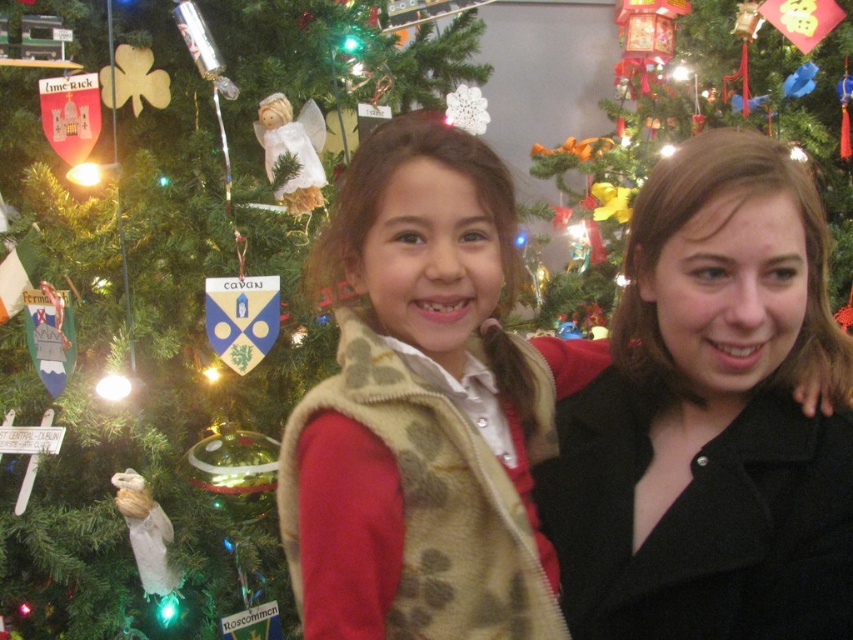
You are a photographer standing 5 feet away from the green matte christmas tree at left. Can you take a clear photo of it without moving closer?

The green matte christmas tree at left is 4.07 feet from the camera, so you are currently 0.93 feet away from it. Therefore, you can take a clear photo without needing to move closer.

You are standing in front of the Christmas tree and want to know which of the two points, point (785,547) or point (173,100), is closer to you. Can you determine this based on the scene?

Point (785,547) is closer to the viewer than point (173,100).

You are a photographer trying to capture a clear photo of the black matte coat at center and the green matte christmas tree at left. Which object should you focus on first to ensure both are in focus?

The black matte coat at center is in front of the green matte christmas tree at left, so you should focus on the green matte christmas tree at left first to ensure both are in focus.